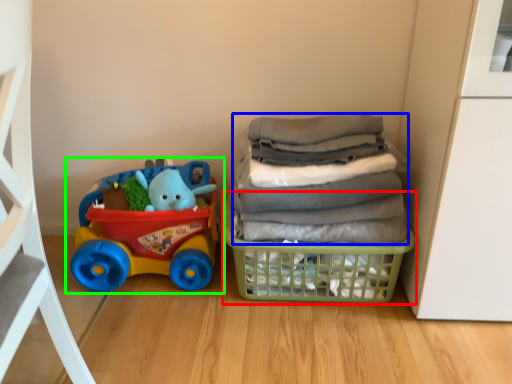
Question: Which object is the farthest from basket (highlighted by a red box)? Choose among these: laundry (highlighted by a blue box) or toy (highlighted by a green box).

Choices:
 (A) laundry
 (B) toy

Answer: (B)